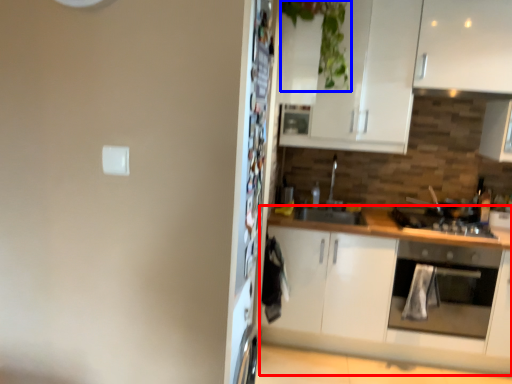
Question: Which object appears farthest to the camera in this image, cabinetry (highlighted by a red box) or plant (highlighted by a blue box)?

Choices:
 (A) cabinetry
 (B) plant

Answer: (A)